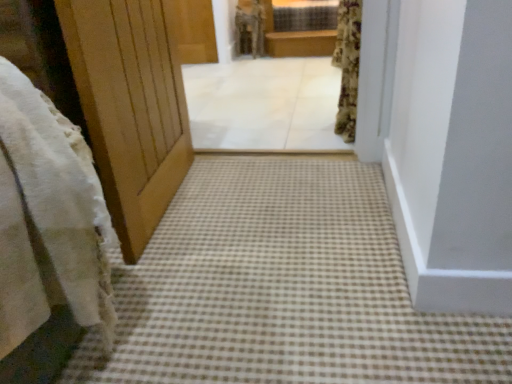
Question: In terms of height, does brown wooden balustrade at upper center look taller or shorter compared to fluffy floral curtain at upper right?

Choices:
 (A) tall
 (B) short

Answer: (B)

Question: From the image's perspective, is brown wooden balustrade at upper center above or below fluffy floral curtain at upper right?

Choices:
 (A) below
 (B) above

Answer: (B)

Question: Considering the real-world distances, which object is farthest from the brown checkered carpet at center?

Choices:
 (A) fluffy floral curtain at upper right
 (B) white tile floor at center
 (C) plaid fabric window at upper center
 (D) brown wooden balustrade at upper center
 (E) white fluffy robe at upper center

Answer: (E)

Question: Estimate the real-world distances between objects in this image. Which object is farther from the white fluffy robe at upper center?

Choices:
 (A) fluffy floral curtain at upper right
 (B) white tile floor at center
 (C) plaid fabric window at upper center
 (D) brown checkered carpet at center
 (E) brown wooden balustrade at upper center

Answer: (D)